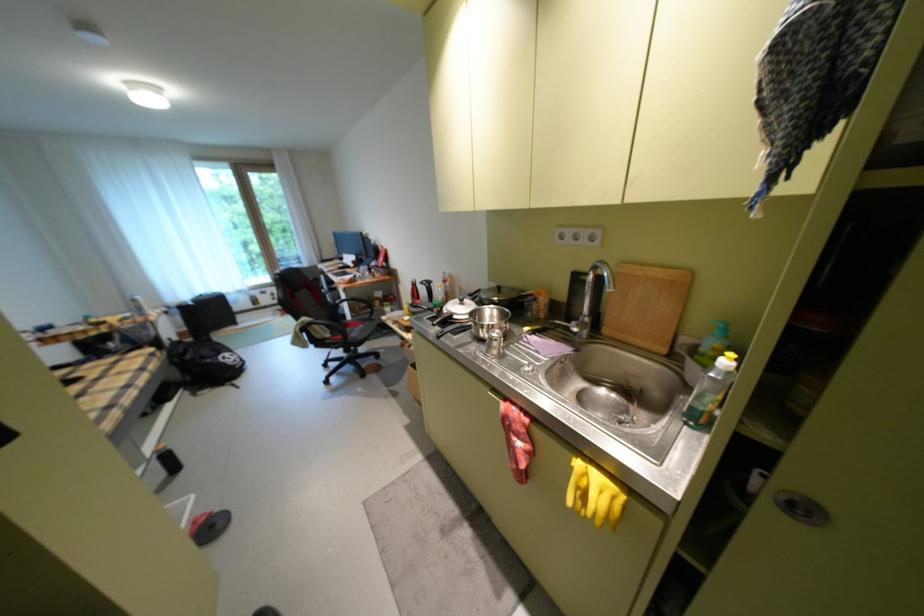
What do you see at coordinates (503, 296) in the screenshot?
I see `the black pan handle` at bounding box center [503, 296].